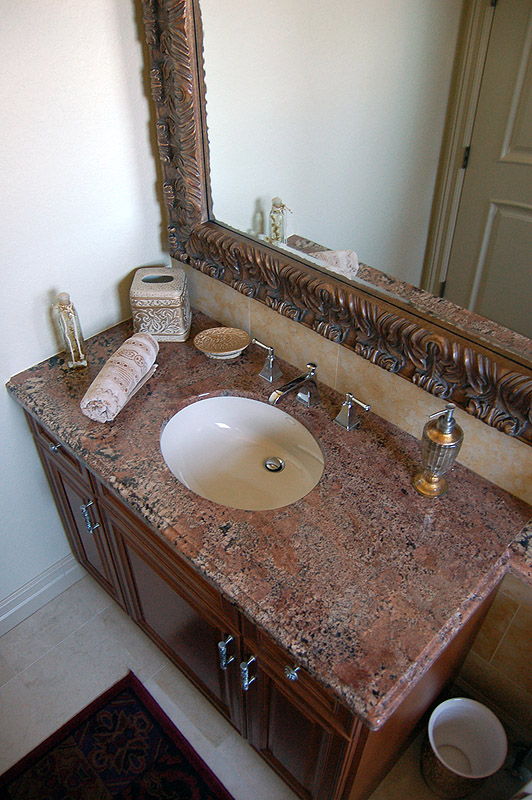
Find the location of a particular element. The height and width of the screenshot is (800, 532). ornate gold frame is located at coordinates (232, 278).